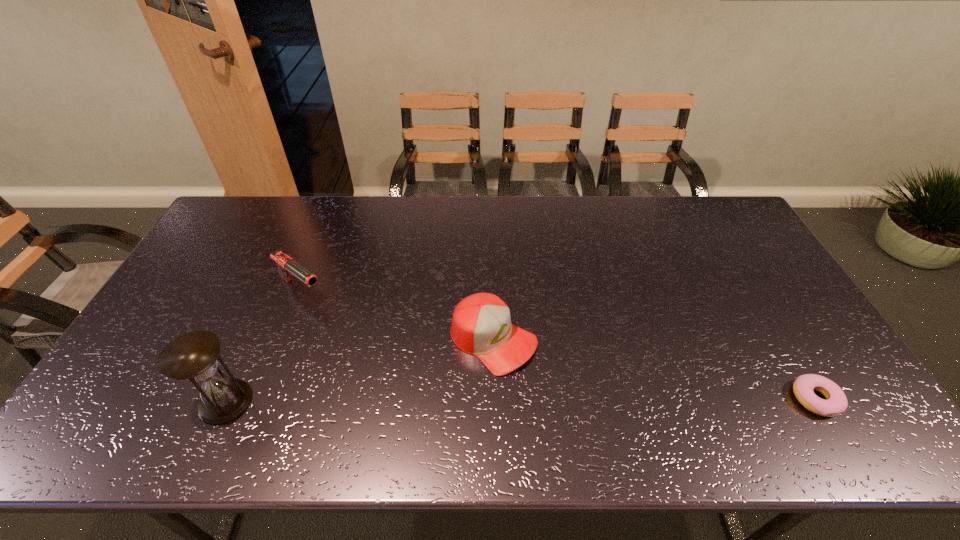
This screenshot has height=540, width=960. Identify the location of vacant region at the right edge of the desktop. (778, 282).

Identify the location of vacant region at the far left corner. (274, 197).

Locate an element on the screen. empty space that is in between the second object from right to left and the gun is located at coordinates (397, 315).

Locate an element on the screen. This screenshot has height=540, width=960. vacant region between the baseball cap and the tallest object is located at coordinates (360, 370).

This screenshot has height=540, width=960. I want to click on vacant space in between the gun and the baseball cap, so click(397, 315).

Identify the location of blank region between the gun and the doughnut. (559, 345).

Locate an element on the screen. vacant point located between the doughnut and the gun is located at coordinates (559, 345).

The width and height of the screenshot is (960, 540). I want to click on vacant space that's between the gun and the hourglass, so click(x=264, y=346).

Locate an element on the screen. free point between the doughnut and the baseball cap is located at coordinates (655, 369).

I want to click on vacant area that lies between the shortest object and the baseball cap, so click(655, 369).